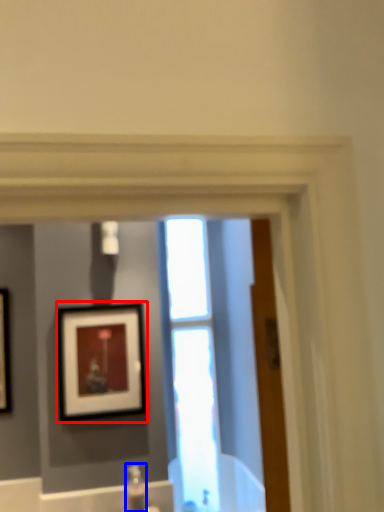
Question: Which point is further to the camera, picture frame (highlighted by a red box) or plumbing fixture (highlighted by a blue box)?

Choices:
 (A) picture frame
 (B) plumbing fixture

Answer: (A)